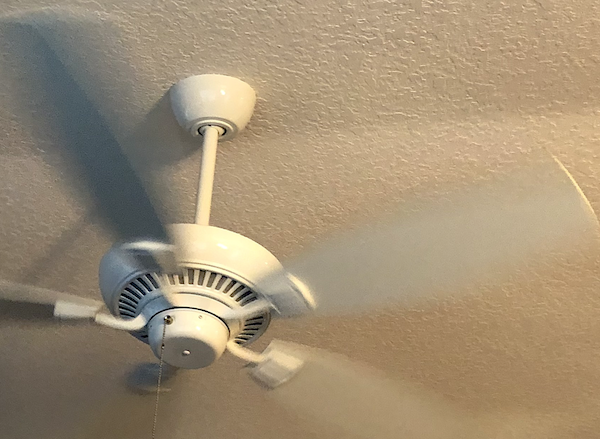
The image size is (600, 439). Identify the location of fan vent section. (129, 292), (144, 280), (190, 277), (217, 282), (240, 292), (252, 324), (244, 340), (143, 335).